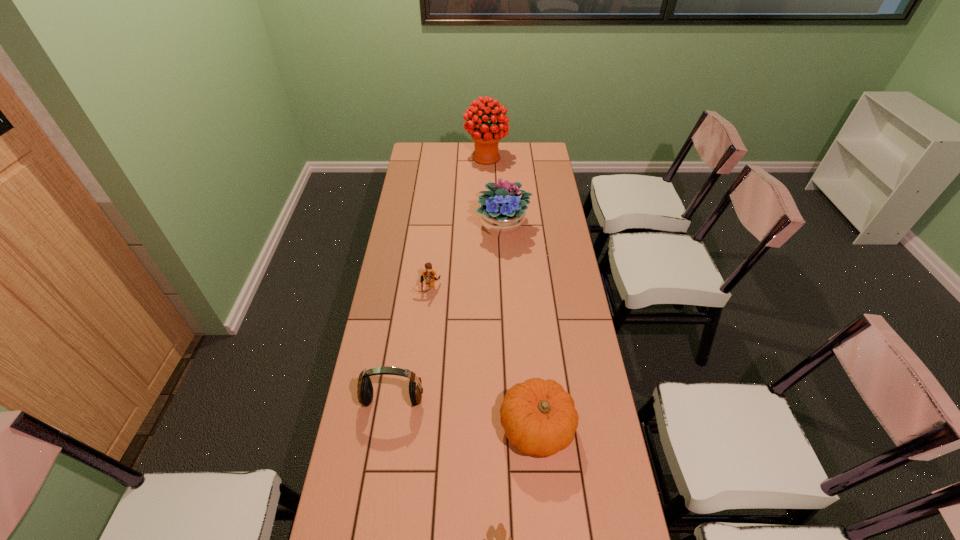
This screenshot has height=540, width=960. In order to click on vacant region located on the back of the pumpkin in this screenshot , I will do `click(531, 370)`.

The height and width of the screenshot is (540, 960). Identify the location of free space located holding a crossbow in the hands of the Lego. (420, 362).

Locate an element on the screen. The image size is (960, 540). object located at the far edge is located at coordinates (486, 137).

Locate an element on the screen. Image resolution: width=960 pixels, height=540 pixels. headset positioned at the left edge is located at coordinates click(365, 392).

At what (x,y) coordinates should I click in order to perform the action: click on Lego positioned at the left edge. Please return your answer as a coordinate pair (x, y). Looking at the image, I should click on (429, 274).

Find the location of a particular element. The width and height of the screenshot is (960, 540). bouquet at the right edge is located at coordinates pos(501,211).

The width and height of the screenshot is (960, 540). What are the coordinates of `pumpkin located in the right edge section of the desktop` in the screenshot? It's located at (538, 416).

The image size is (960, 540). In the image, there is a desktop. In order to click on vacant area at the far edge in this screenshot , I will do `click(445, 143)`.

The width and height of the screenshot is (960, 540). In the image, there is a desktop. What are the coordinates of `vacant region at the left edge` in the screenshot? It's located at (437, 174).

Where is `vacant space at the right edge of the desktop`? vacant space at the right edge of the desktop is located at coordinates (551, 222).